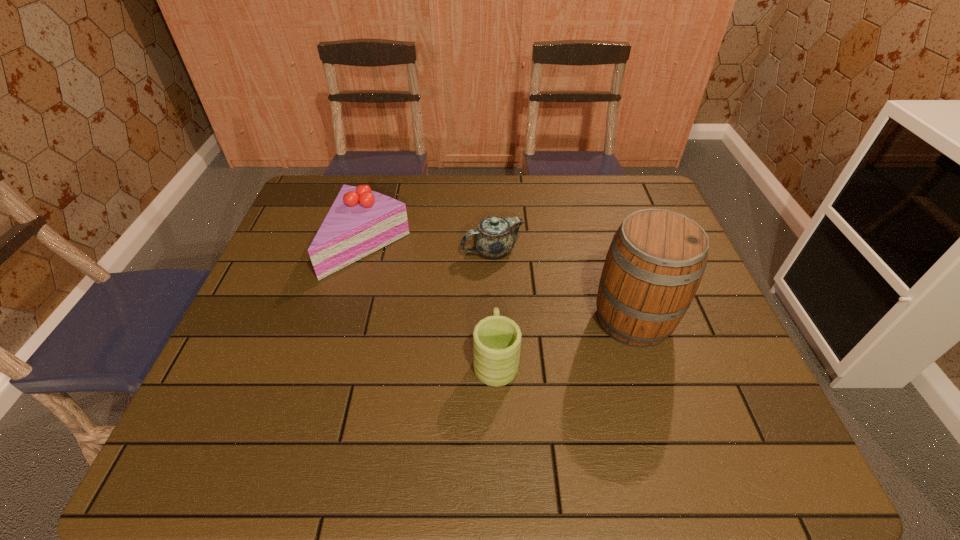
Identify the location of free location located 0.370m on the side of the mug with the handle. This screenshot has width=960, height=540. (492, 235).

Image resolution: width=960 pixels, height=540 pixels. In order to click on blank space located 0.300m from the spout of the chinaware in this screenshot , I will do `click(358, 251)`.

Find the location of `vacant space situated from the spout of the chinaware`. vacant space situated from the spout of the chinaware is located at coordinates (378, 251).

Locate an element on the screen. free space located 0.310m from the spout of the chinaware is located at coordinates (354, 251).

I want to click on object that is positioned at the far edge, so click(x=360, y=221).

The height and width of the screenshot is (540, 960). Find the location of `object that is at the left edge`. object that is at the left edge is located at coordinates (360, 221).

At what (x,y) coordinates should I click in order to perform the action: click on object at the right edge. Please return your answer as a coordinate pair (x, y). Looking at the image, I should click on (655, 263).

Where is `object situated at the far left corner`? This screenshot has width=960, height=540. object situated at the far left corner is located at coordinates (360, 221).

Locate an element on the screen. Image resolution: width=960 pixels, height=540 pixels. vacant space at the far edge of the desktop is located at coordinates (452, 212).

At what (x,y) coordinates should I click in order to perform the action: click on free region at the near edge of the desktop. Please return your answer as a coordinate pair (x, y). The height and width of the screenshot is (540, 960). Looking at the image, I should click on (696, 465).